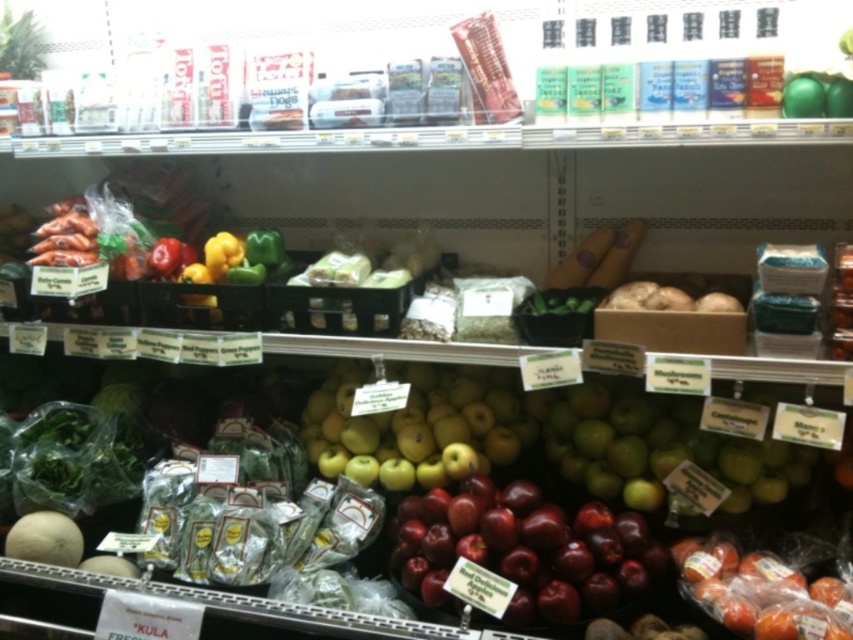
Does green matte apples at center lie in front of shiny red apples at lower right?

No.

Which is more to the left, green matte apples at center or shiny red apples at lower right?

From the viewer's perspective, green matte apples at center appears more on the left side.

Does point (674, 454) come behind point (723, 589)?

Yes, it is behind point (723, 589).

Identify the location of green matte apples at center. (660, 449).

Which of these two, yellow matte apples at center or green matte apples at center, stands shorter?

Standing shorter between the two is green matte apples at center.

Can you confirm if yellow matte apples at center is shorter than green matte apples at center?

In fact, yellow matte apples at center may be taller than green matte apples at center.

Who is more forward, (352, 452) or (578, 417)?

→ Point (578, 417)

This screenshot has width=853, height=640. Find the location of `yellow matte apples at center`. yellow matte apples at center is located at coordinates (418, 428).

Between shiny red apples at center and shiny red apples at lower right, which one appears on the left side from the viewer's perspective?

shiny red apples at center is more to the left.

Who is higher up, shiny red apples at center or shiny red apples at lower right?

shiny red apples at center is higher up.

This screenshot has width=853, height=640. In order to click on shiny red apples at center in this screenshot , I will do `click(524, 548)`.